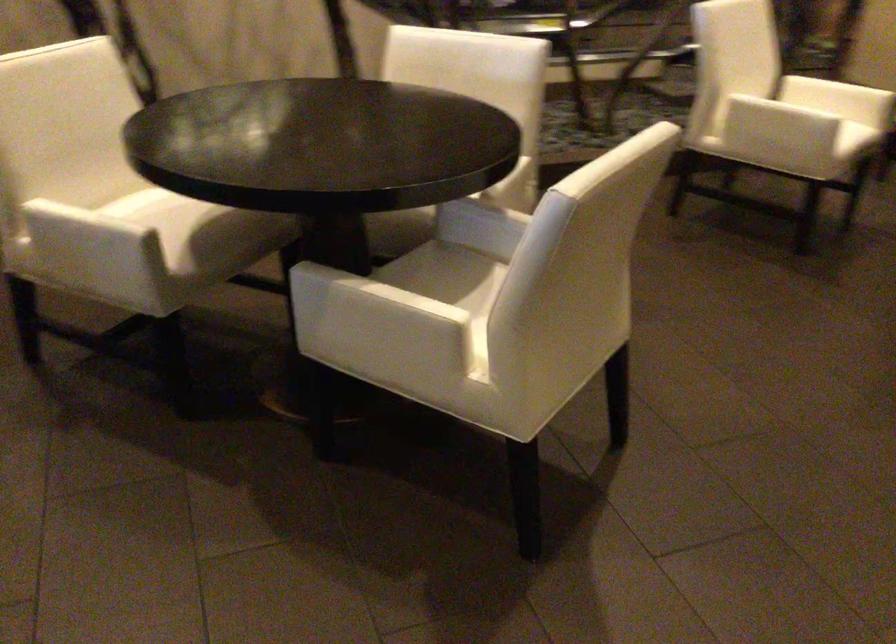
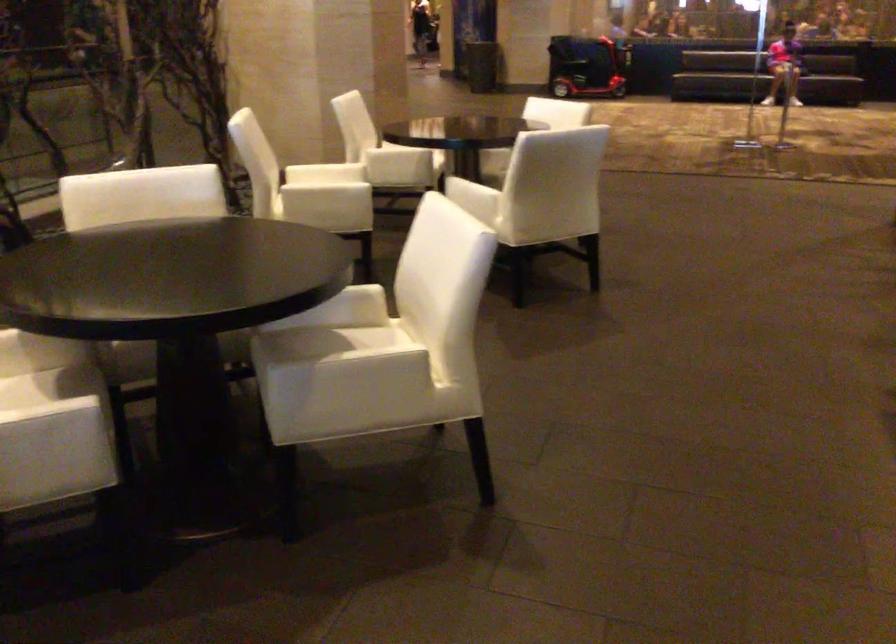
Locate, in the second image, the point that corresponds to point (218, 210) in the first image.

(46, 383)